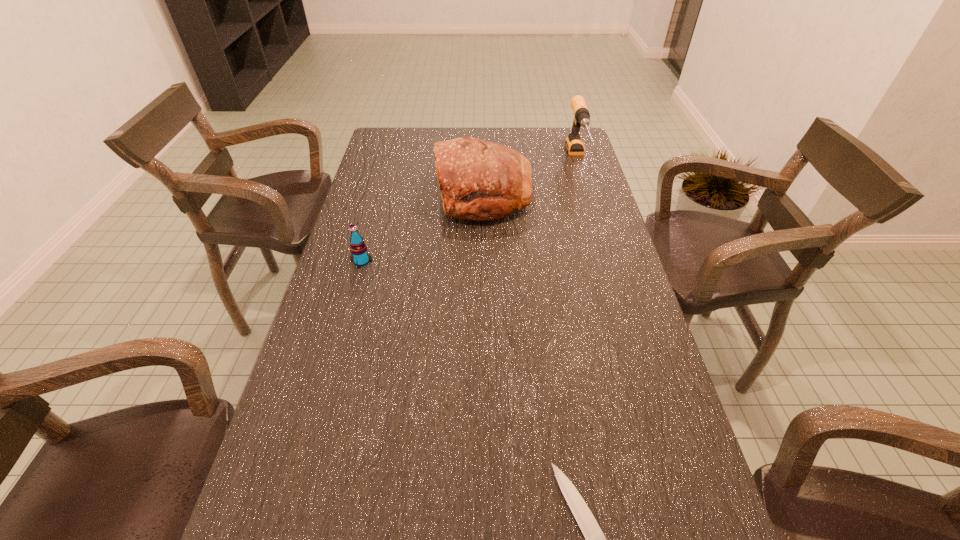
Where is `object that is at the left edge`? object that is at the left edge is located at coordinates (359, 256).

Locate an element on the screen. The width and height of the screenshot is (960, 540). object that is at the right edge is located at coordinates (574, 145).

At what (x,y) coordinates should I click in order to perform the action: click on object present at the far right corner. Please return your answer as a coordinate pair (x, y). This screenshot has height=540, width=960. Looking at the image, I should click on (574, 145).

The height and width of the screenshot is (540, 960). In the image, there is a desktop. Identify the location of free space at the far edge. (420, 142).

Where is `free region at the left edge of the desktop`? This screenshot has height=540, width=960. free region at the left edge of the desktop is located at coordinates (370, 310).

At what (x,y) coordinates should I click in order to perform the action: click on free location at the right edge. Please return your answer as a coordinate pair (x, y). Looking at the image, I should click on (580, 256).

The height and width of the screenshot is (540, 960). Identify the location of vacant space at the far left corner of the desktop. (382, 154).

Find the location of `free location at the far right corner of the desktop`. free location at the far right corner of the desktop is located at coordinates (552, 156).

Locate an element on the screen. free space between the second nearest object and the bread is located at coordinates (422, 227).

Find the location of a particular element. free point between the leftmost object and the bread is located at coordinates (422, 227).